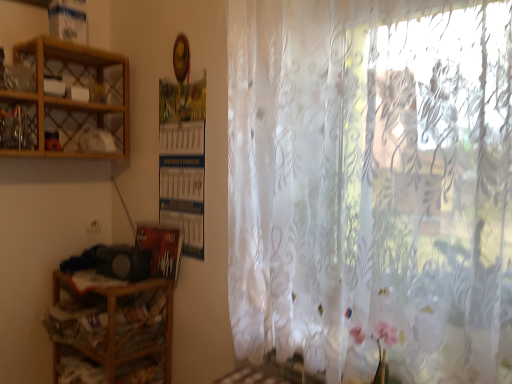
Question: Can you confirm if wooden cabinet at upper left is taller than wooden at left, the 2th shelf from the top?

Choices:
 (A) no
 (B) yes

Answer: (A)

Question: Considering the relative sizes of wooden cabinet at upper left and wooden at left, the 2th shelf from the top, in the image provided, is wooden cabinet at upper left bigger than wooden at left, the 2th shelf from the top,?

Choices:
 (A) no
 (B) yes

Answer: (A)

Question: Is wooden at left, the 2th shelf from the top, completely or partially inside wooden cabinet at upper left?

Choices:
 (A) yes
 (B) no

Answer: (B)

Question: From the image's perspective, is wooden cabinet at upper left under wooden at left, the 2th shelf from the top?

Choices:
 (A) no
 (B) yes

Answer: (A)

Question: Is there a large distance between wooden cabinet at upper left and wooden at left, the 2th shelf from the top?

Choices:
 (A) no
 (B) yes

Answer: (A)

Question: Is point (121, 79) closer or farther from the camera than point (458, 231)?

Choices:
 (A) closer
 (B) farther

Answer: (B)

Question: Do you think woodenobject at upper left, the 2th shelf in the bottom-to-top sequence, is within translucent floral-patterned curtain at right, or outside of it?

Choices:
 (A) outside
 (B) inside

Answer: (A)

Question: From the image's perspective, is woodenobject at upper left, the 2th shelf in the bottom-to-top sequence, above or below translucent floral-patterned curtain at right?

Choices:
 (A) below
 (B) above

Answer: (B)

Question: Is woodenobject at upper left, the first shelf viewed from the top, bigger or smaller than translucent floral-patterned curtain at right?

Choices:
 (A) small
 (B) big

Answer: (A)

Question: In the image, is wooden cabinet at upper left positioned in front of or behind wooden at left, which is the first shelf from bottom to top?

Choices:
 (A) behind
 (B) front

Answer: (B)

Question: Looking at the image, does wooden cabinet at upper left seem bigger or smaller compared to wooden at left, the 2th shelf from the top?

Choices:
 (A) small
 (B) big

Answer: (A)

Question: From their relative heights in the image, would you say wooden cabinet at upper left is taller or shorter than wooden at left, the 2th shelf from the top?

Choices:
 (A) tall
 (B) short

Answer: (B)

Question: Is point (30, 140) closer or farther from the camera than point (55, 281)?

Choices:
 (A) closer
 (B) farther

Answer: (A)

Question: Looking at the image, does wooden at left, the 2th shelf from the top, seem bigger or smaller compared to wooden cabinet at upper left?

Choices:
 (A) big
 (B) small

Answer: (A)

Question: Looking at their shapes, would you say wooden at left, the 2th shelf from the top, is wider or thinner than wooden cabinet at upper left?

Choices:
 (A) wide
 (B) thin

Answer: (A)